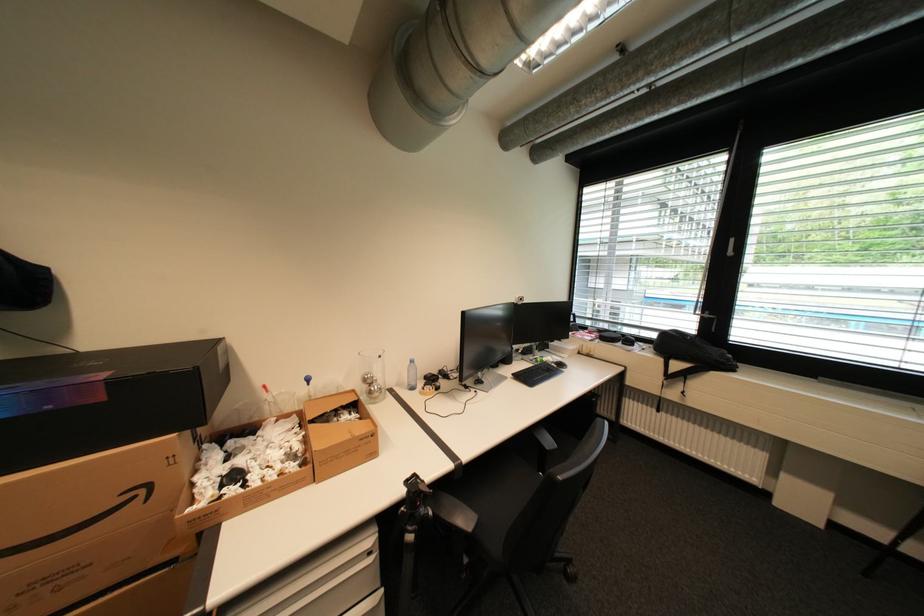
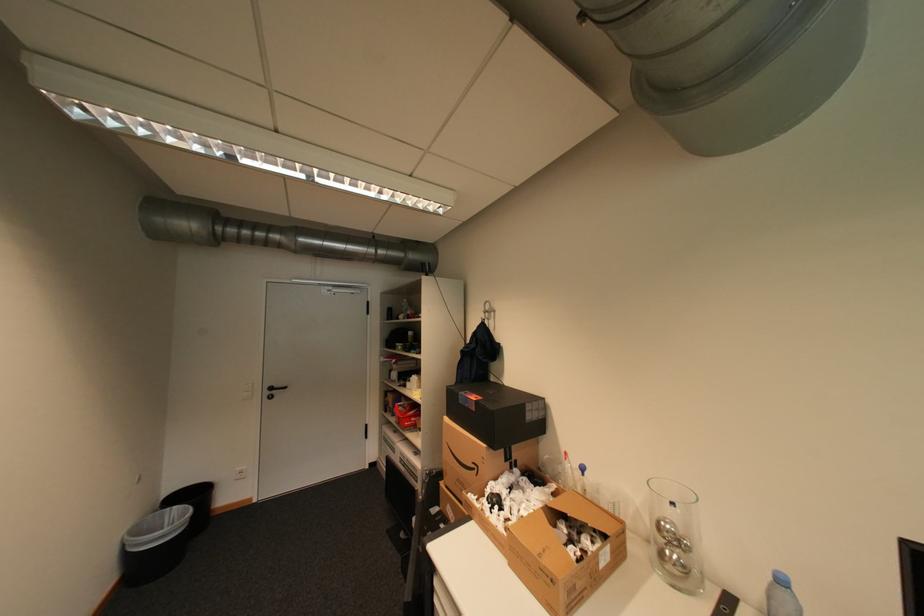
Where in the second image is the point corresponding to the point at 151,491 from the first image?

(484, 468)